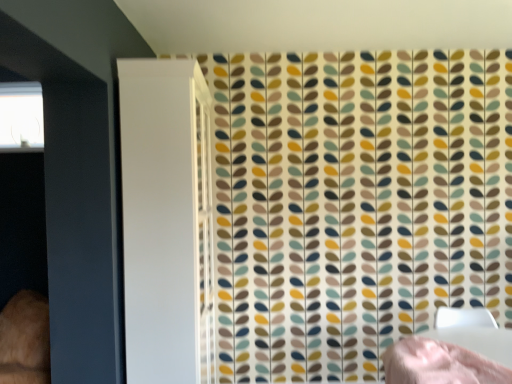
Question: From a real-world perspective, does transparent glass window at upper left sit lower than pink fabric bed at lower right?

Choices:
 (A) yes
 (B) no

Answer: (B)

Question: Is transparent glass window at upper left wider than pink fabric bed at lower right?

Choices:
 (A) yes
 (B) no

Answer: (B)

Question: Does transparent glass window at upper left turn towards pink fabric bed at lower right?

Choices:
 (A) no
 (B) yes

Answer: (A)

Question: Considering the relative sizes of transparent glass window at upper left and pink fabric bed at lower right in the image provided, is transparent glass window at upper left shorter than pink fabric bed at lower right?

Choices:
 (A) yes
 (B) no

Answer: (B)

Question: Is transparent glass window at upper left at the left side of pink fabric bed at lower right?

Choices:
 (A) yes
 (B) no

Answer: (A)

Question: Is transparent glass window at upper left oriented away from pink fabric bed at lower right?

Choices:
 (A) no
 (B) yes

Answer: (A)

Question: Considering the relative sizes of white glossy screen door at left and pink fabric bed at lower right in the image provided, is white glossy screen door at left shorter than pink fabric bed at lower right?

Choices:
 (A) yes
 (B) no

Answer: (B)

Question: Is white glossy screen door at left far away from pink fabric bed at lower right?

Choices:
 (A) no
 (B) yes

Answer: (B)

Question: From the image's perspective, is white glossy screen door at left below pink fabric bed at lower right?

Choices:
 (A) no
 (B) yes

Answer: (A)

Question: Is white glossy screen door at left positioned in front of pink fabric bed at lower right?

Choices:
 (A) yes
 (B) no

Answer: (B)

Question: Does white glossy screen door at left lie behind pink fabric bed at lower right?

Choices:
 (A) no
 (B) yes

Answer: (B)

Question: Can you confirm if white glossy screen door at left is bigger than pink fabric bed at lower right?

Choices:
 (A) yes
 (B) no

Answer: (A)

Question: From the image's perspective, does transparent glass window at upper left appear higher than white glossy screen door at left?

Choices:
 (A) yes
 (B) no

Answer: (A)